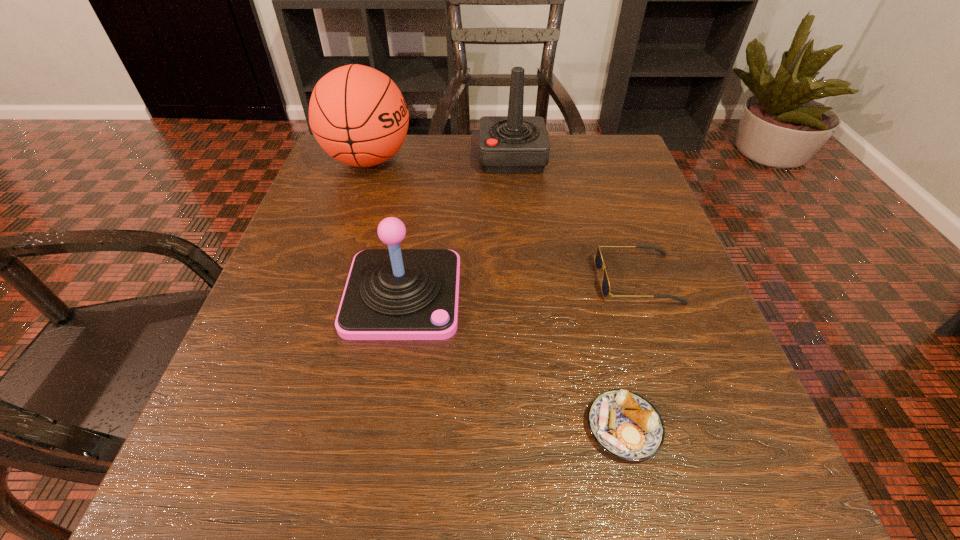
Image resolution: width=960 pixels, height=540 pixels. I want to click on vacant space that satisfies the following two spatial constraints: 1. forward from the base of the left joystick; 2. on the right side of the nearest object, so click(x=381, y=427).

At what (x,y) coordinates should I click in order to perform the action: click on vacant space that satisfies the following two spatial constraints: 1. forward from the base of the nearest object; 2. on the left side of the left joystick. Please return your answer as a coordinate pair (x, y). The image size is (960, 540). Looking at the image, I should click on (381, 427).

Locate an element on the screen. The width and height of the screenshot is (960, 540). vacant space that satisfies the following two spatial constraints: 1. forward from the base of the nearest object; 2. on the right side of the left joystick is located at coordinates (381, 427).

Identify the location of vacant space that satisfies the following two spatial constraints: 1. on the front-facing side of the farther joystick; 2. on the left side of the nearest object. This screenshot has height=540, width=960. (538, 427).